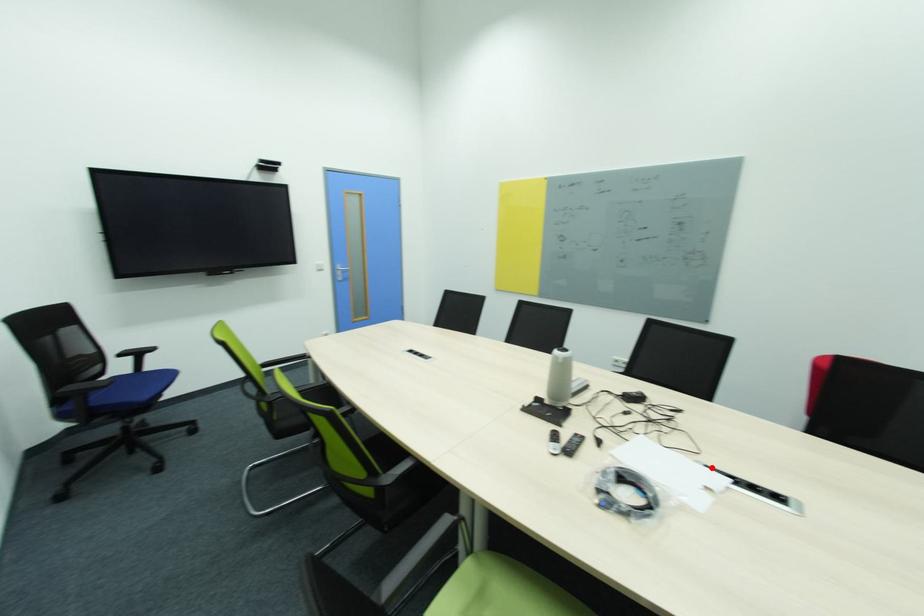
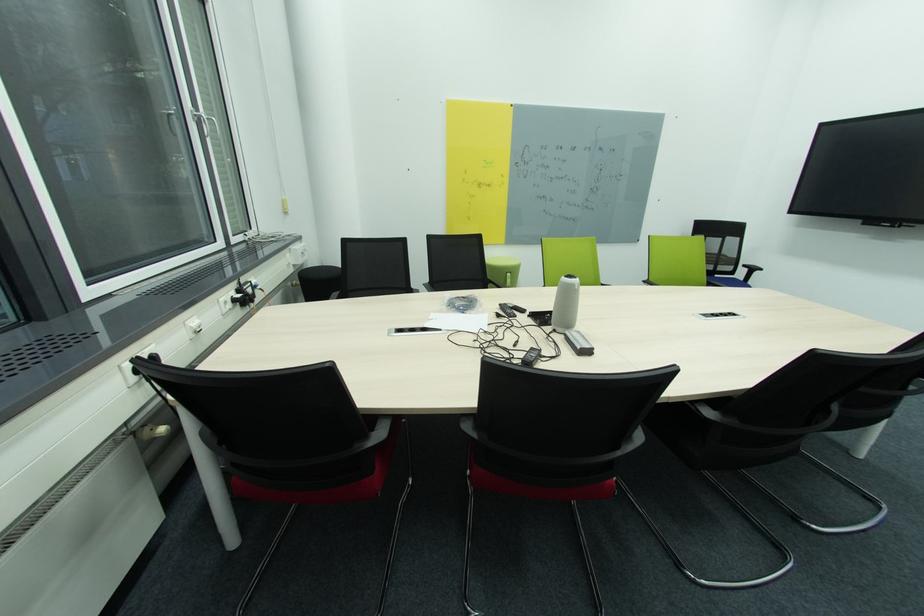
Where in the second image is the point corresponding to the highlighted location from the first image?

(444, 331)